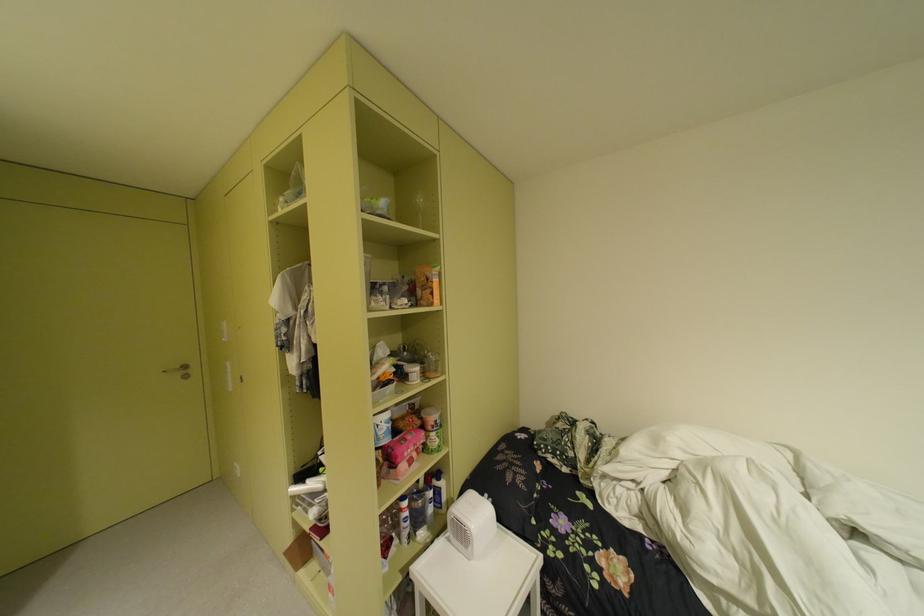
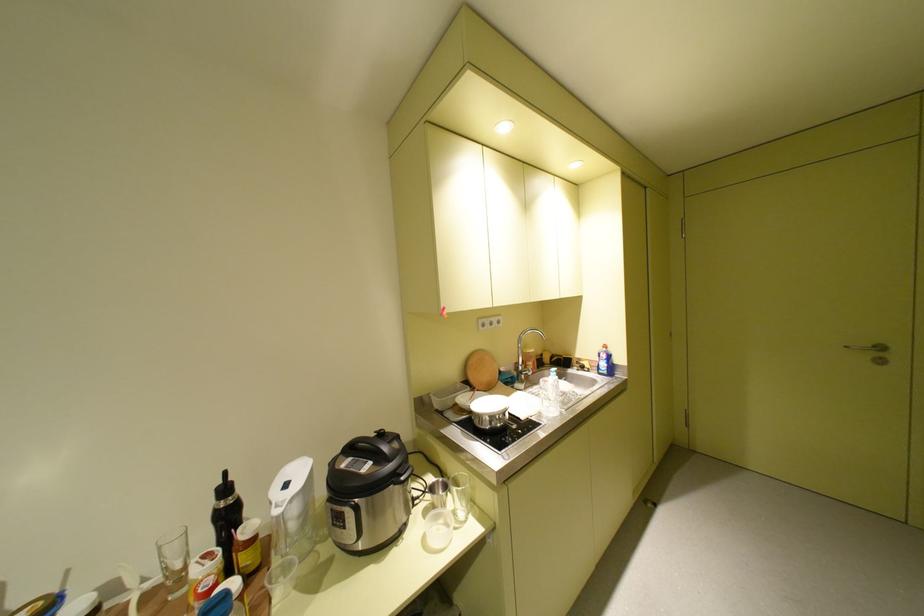
Question: The camera is either moving clockwise (left) or counter-clockwise (right) around the object. The first image is from the beginning of the video and the second image is from the end. Is the camera moving left or right when shooting the video?

Choices:
 (A) Left
 (B) Right

Answer: (B)